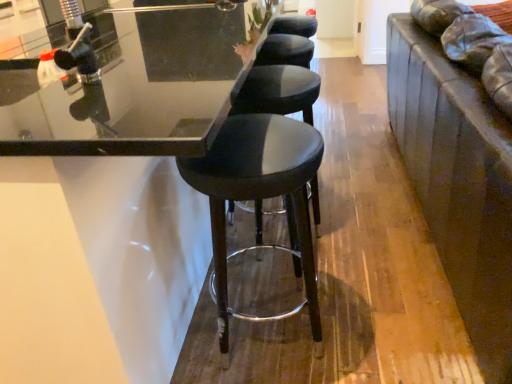
Question: From the image's perspective, is black leather stool at center, placed as the 2th stool when sorted from back to front, located above or below black leather stool at center, which is the first stool from back to front?

Choices:
 (A) below
 (B) above

Answer: (A)

Question: Visually, is black leather stool at center, placed as the 2th stool when sorted from back to front, positioned to the left or to the right of black leather stool at center, which is counted as the second stool, starting from the front?

Choices:
 (A) right
 (B) left

Answer: (B)

Question: Considering the positions of black leather stool at center, placed as the 2th stool when sorted from back to front, and black leather stool at center, which is the first stool from back to front, in the image, is black leather stool at center, placed as the 2th stool when sorted from back to front, taller or shorter than black leather stool at center, which is the first stool from back to front,?

Choices:
 (A) short
 (B) tall

Answer: (A)

Question: From the image's perspective, is black leather stool at center, which is counted as the second stool, starting from the front, above or below black leather stool at center, which is the first stool from front to back?

Choices:
 (A) above
 (B) below

Answer: (A)

Question: Looking at their shapes, would you say black leather stool at center, which is the first stool from back to front, is wider or thinner than black leather stool at center, which is the first stool from front to back?

Choices:
 (A) wide
 (B) thin

Answer: (B)

Question: Considering their positions, is black leather stool at center, which is the first stool from back to front, located in front of or behind black leather stool at center, placed as the 2th stool when sorted from back to front?

Choices:
 (A) behind
 (B) front

Answer: (A)

Question: Based on their sizes in the image, would you say black leather stool at center, which is the first stool from back to front, is bigger or smaller than black leather stool at center, which is the first stool from front to back?

Choices:
 (A) small
 (B) big

Answer: (B)